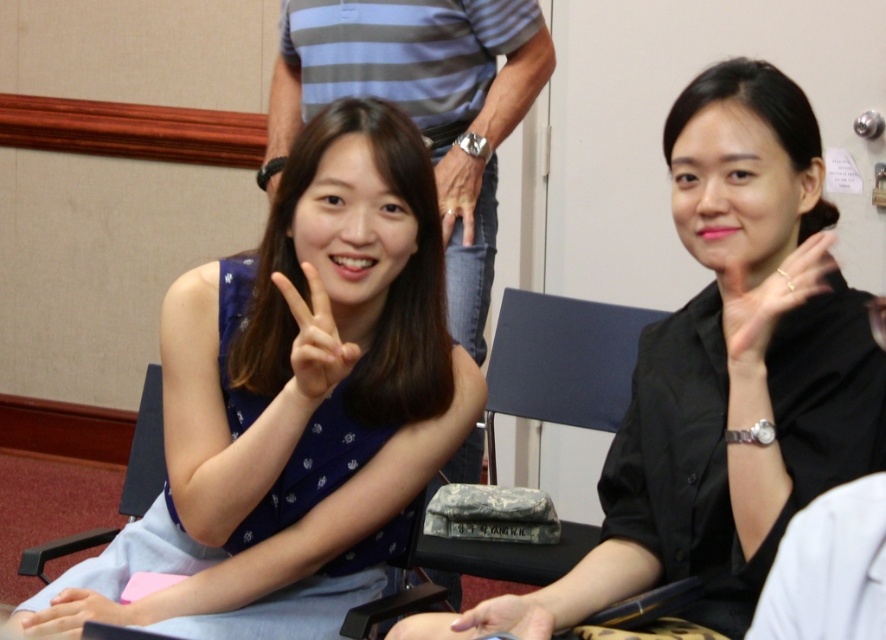
You are organizing a photoshoot and need to ensure that the blue striped shirt at upper center and the blue fabric chair at left are visible in the final image. Based on their positions, which object is closer to the camera?

The blue striped shirt at upper center is positioned over the blue fabric chair at left, so the blue striped shirt at upper center is closer to the camera.

You are organizing a photoshoot and need to ensure that the blue dotted dress at left and the camouflage fabric bag at center are both visible in the frame. Given their sizes, which object should you prioritize positioning closer to the camera to maintain clarity?

The blue dotted dress at left is smaller than the camouflage fabric bag at center, so you should prioritize positioning the blue dotted dress at left closer to the camera to ensure its details are clearly visible.

Based on the scene description, where is the blue striped shirt at upper center located in the image?

The blue striped shirt at upper center is located at point (422, 106).